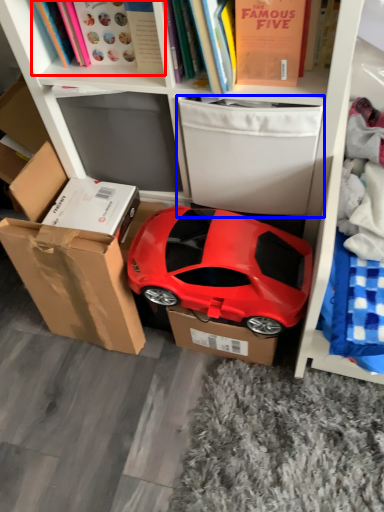
Question: Which point is closer to the camera, book (highlighted by a red box) or storage box (highlighted by a blue box)?

Choices:
 (A) book
 (B) storage box

Answer: (A)